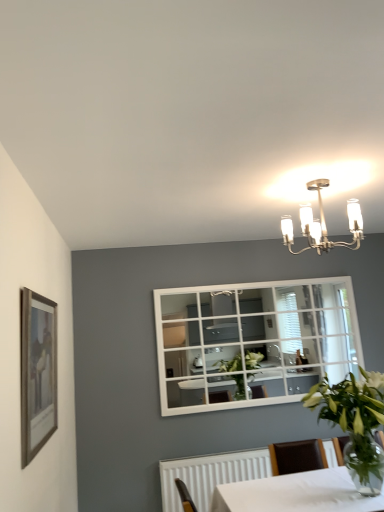
Question: Does wooden framed picture at left have a smaller size compared to satin nickel chandelier at upper center?

Choices:
 (A) yes
 (B) no

Answer: (A)

Question: Can we say wooden framed picture at left lies outside satin nickel chandelier at upper center?

Choices:
 (A) yes
 (B) no

Answer: (A)

Question: From a real-world perspective, is wooden framed picture at left under satin nickel chandelier at upper center?

Choices:
 (A) no
 (B) yes

Answer: (B)

Question: Is satin nickel chandelier at upper center surrounded by wooden framed picture at left?

Choices:
 (A) no
 (B) yes

Answer: (A)

Question: Considering the relative sizes of wooden framed picture at left and satin nickel chandelier at upper center in the image provided, is wooden framed picture at left wider than satin nickel chandelier at upper center?

Choices:
 (A) no
 (B) yes

Answer: (A)

Question: Is satin nickel chandelier at upper center wider or thinner than green leafy plant in clear glass vase at lower right?

Choices:
 (A) wide
 (B) thin

Answer: (B)

Question: Is satin nickel chandelier at upper center spatially inside green leafy plant in clear glass vase at lower right, or outside of it?

Choices:
 (A) outside
 (B) inside

Answer: (A)

Question: Considering their positions, is satin nickel chandelier at upper center located in front of or behind green leafy plant in clear glass vase at lower right?

Choices:
 (A) front
 (B) behind

Answer: (B)

Question: From the image's perspective, relative to green leafy plant in clear glass vase at lower right, is satin nickel chandelier at upper center above or below?

Choices:
 (A) below
 (B) above

Answer: (B)

Question: Considering the positions of wooden framed picture at left and satin nickel chandelier at upper center in the image, is wooden framed picture at left wider or thinner than satin nickel chandelier at upper center?

Choices:
 (A) thin
 (B) wide

Answer: (A)

Question: In the image, is wooden framed picture at left positioned in front of or behind satin nickel chandelier at upper center?

Choices:
 (A) behind
 (B) front

Answer: (B)

Question: From a real-world perspective, is wooden framed picture at left positioned above or below satin nickel chandelier at upper center?

Choices:
 (A) below
 (B) above

Answer: (A)

Question: From their relative heights in the image, would you say wooden framed picture at left is taller or shorter than satin nickel chandelier at upper center?

Choices:
 (A) tall
 (B) short

Answer: (A)

Question: Is wooden framed picture at left to the left or to the right of green leafy plant in clear glass vase at lower right in the image?

Choices:
 (A) right
 (B) left

Answer: (B)

Question: Considering their positions, is wooden framed picture at left located in front of or behind green leafy plant in clear glass vase at lower right?

Choices:
 (A) behind
 (B) front

Answer: (B)